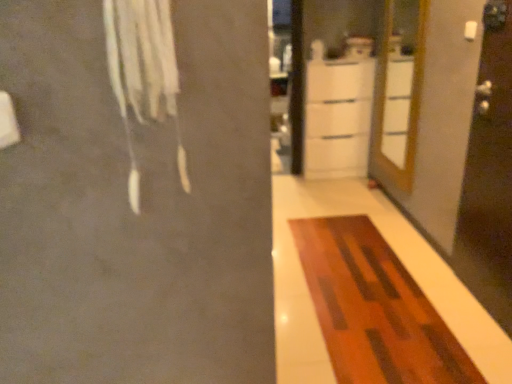
Question: From the image's perspective, relative to wooden at right, is white glossy cabinet at center above or below?

Choices:
 (A) above
 (B) below

Answer: (B)

Question: Does point (307, 117) appear closer or farther from the camera than point (379, 99)?

Choices:
 (A) farther
 (B) closer

Answer: (A)

Question: Which of these objects is positioned farthest from the transparent glass screen door at right?

Choices:
 (A) white glossy cabinet at center
 (B) wooden at right
 (C) white fabric at upper left
 (D) wooden rug at center

Answer: (A)

Question: Based on their relative distances, which object is nearer to the white glossy cabinet at center?

Choices:
 (A) wooden rug at center
 (B) transparent glass screen door at right
 (C) wooden at right
 (D) white fabric at upper left

Answer: (C)